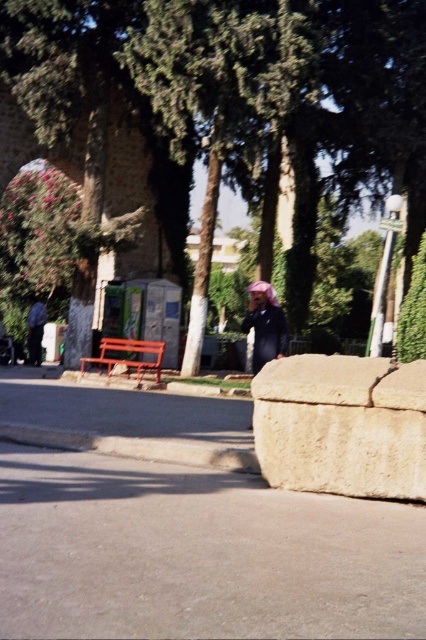
You are standing at the lower right corner of the image. You want to take a photo of the green leafy tree at center without the beige rough stone at lower right blocking the view. Is the tree visible in your current position?

The green leafy tree at center is above the beige rough stone at lower right, so yes, the tree is visible from the lower right corner position because it is positioned higher up and not blocked by the stone.

You are standing at the entrance of a historical site and see the smooth concrete pavement at lower center and the dark blue fabric at center. Which object is located lower in the image?

The smooth concrete pavement at lower center is located below the dark blue fabric at center, so it is lower in the image.